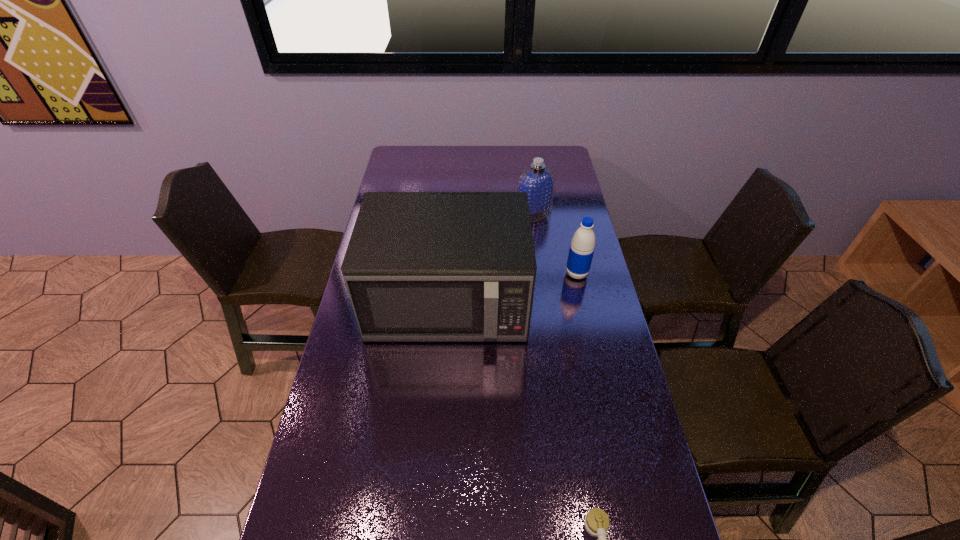
Locate an element on the screen. Image resolution: width=960 pixels, height=540 pixels. microwave oven is located at coordinates (420, 266).

Identify the location of cleansing agent. (538, 181).

You are a GUI agent. You are given a task and a screenshot of the screen. Output one action in this format:
    pyautogui.click(x=<x>, y=<y>)
    Task: Click on the water bottle
    Image resolution: width=960 pixels, height=540 pixels.
    Given the screenshot: What is the action you would take?
    pyautogui.click(x=582, y=246)

Identify the location of vacant area situated on the front-facing side of the tallest object. (441, 395).

I want to click on free space located on the back of the farthest object, so click(x=527, y=172).

Identify the location of vacant position located on the left of the rightmost object. The height and width of the screenshot is (540, 960). (485, 274).

Where is `object that is at the left edge`? object that is at the left edge is located at coordinates (420, 266).

Locate an element on the screen. The image size is (960, 540). cleansing agent that is at the right edge is located at coordinates (538, 181).

This screenshot has height=540, width=960. I want to click on water bottle present at the right edge, so click(582, 246).

In order to click on free space at the far edge of the desktop in this screenshot , I will do (x=517, y=159).